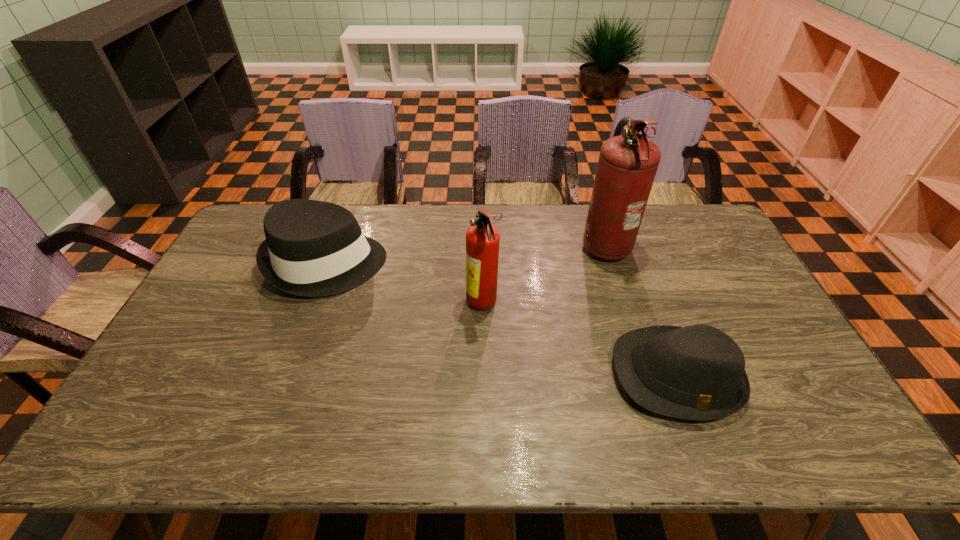
Identify the location of the farther fire extinguisher. (627, 165).

At what (x,y) coordinates should I click in order to perform the action: click on the tallest object. Please return your answer as a coordinate pair (x, y). Looking at the image, I should click on (627, 165).

Find the location of a particular element. the nearer fire extinguisher is located at coordinates (482, 239).

At what (x,y) coordinates should I click in order to perform the action: click on the shorter fire extinguisher. Please return your answer as a coordinate pair (x, y). The width and height of the screenshot is (960, 540). Looking at the image, I should click on (482, 239).

The width and height of the screenshot is (960, 540). I want to click on the leftmost object, so click(x=313, y=248).

Locate an element on the screen. The image size is (960, 540). the left fedora is located at coordinates (313, 248).

Where is `the nearer fedora`? the nearer fedora is located at coordinates (697, 372).

Identify the location of the nearest object. The height and width of the screenshot is (540, 960). (697, 372).

Where is `vacant area situated 0.250m at the front of the tallest object where the nozzle is aimed`? The width and height of the screenshot is (960, 540). vacant area situated 0.250m at the front of the tallest object where the nozzle is aimed is located at coordinates (509, 243).

Where is `free space located at the front of the tallest object where the nozzle is aimed`? free space located at the front of the tallest object where the nozzle is aimed is located at coordinates (532, 243).